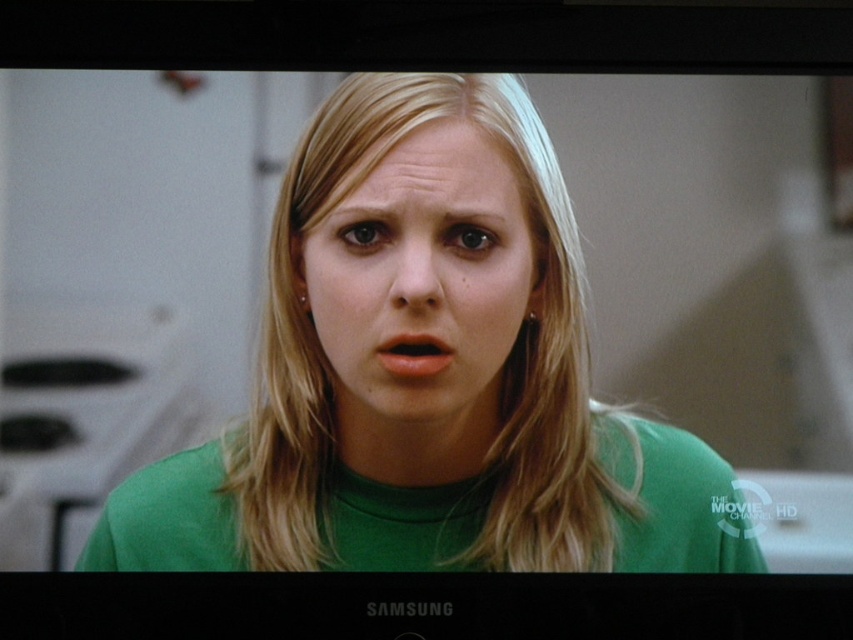
Question: Does green matte shirt at center have a greater width compared to matte pink lips at center?

Choices:
 (A) yes
 (B) no

Answer: (A)

Question: Considering the relative positions of green matte shirt at center and matte green face at center in the image provided, where is green matte shirt at center located with respect to matte green face at center?

Choices:
 (A) right
 (B) left

Answer: (B)

Question: Is matte green face at center thinner than matte pink lips at center?

Choices:
 (A) yes
 (B) no

Answer: (B)

Question: Which point is closer to the camera taking this photo?

Choices:
 (A) (283, 451)
 (B) (393, 358)
 (C) (503, 305)

Answer: (A)

Question: Based on their relative distances, which object is nearer to the green matte shirt at center?

Choices:
 (A) matte pink lips at center
 (B) matte green face at center

Answer: (B)

Question: Which object is the closest to the matte pink lips at center?

Choices:
 (A) green matte shirt at center
 (B) matte green face at center

Answer: (B)